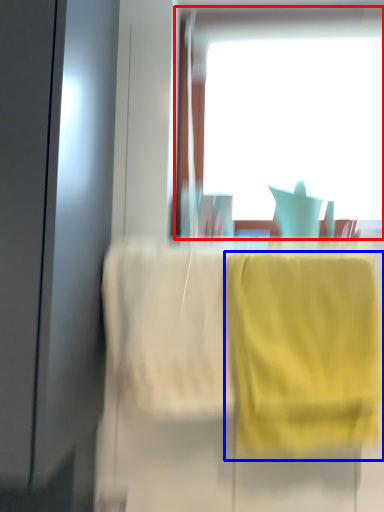
Question: Which object appears closest to the camera in this image, window (highlighted by a red box) or towel/napkin (highlighted by a blue box)?

Choices:
 (A) window
 (B) towel/napkin

Answer: (B)